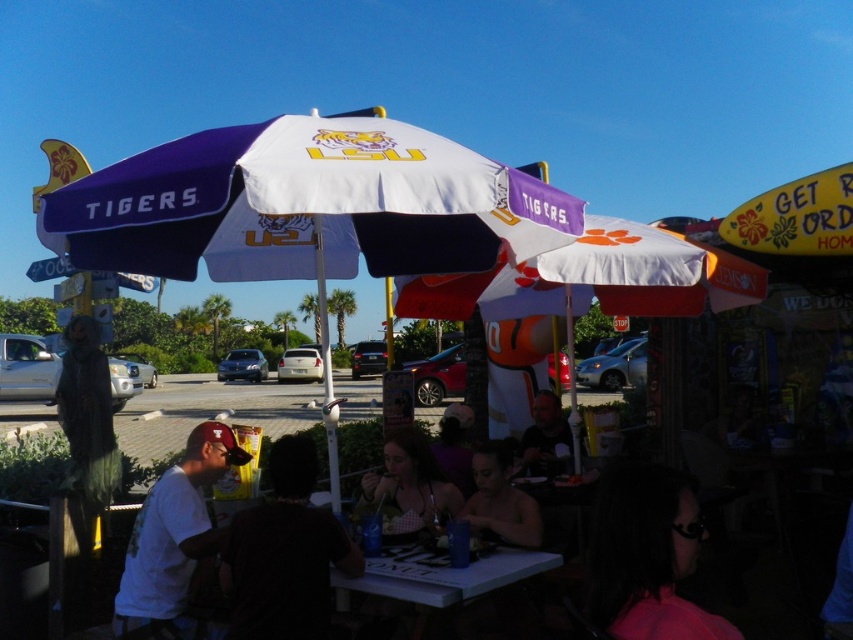
You are organizing a small outdoor event and need to arrange seating. You have a polka dot dress at center and a white plastic pole at center in the way. Which object should you move to free up more space?

The polka dot dress at center occupies less space than the white plastic pole at center, so you should move the polka dot dress at center to free up more space.

You are a photographer positioned at the edge of the outdoor dining area. You want to take a photo that includes both the polka dot dress at center and the white plastic pole at center. Which object should you adjust your focus on to ensure both are in the frame without moving your position?

Since the polka dot dress at center is closer to you than the white plastic pole at center, you should focus on the polka dot dress at center to ensure both are in the frame without moving your position.

You are standing in the outdoor dining area and want to walk from point A to point B. Point A is at coordinates point (613, 291) and point B is at coordinates point (412, 442). Since you can only move forward, will you have to walk towards or away from the dining area to reach point B from point A?

Point (613, 291) is further to the viewer than point (412, 442). To reach point B from point A, you would need to walk away from the dining area towards the background.